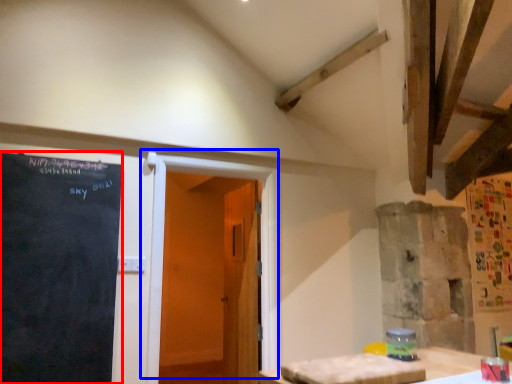
Question: Which object is closer to the camera taking this photo, blackboard (highlighted by a red box) or door (highlighted by a blue box)?

Choices:
 (A) blackboard
 (B) door

Answer: (A)